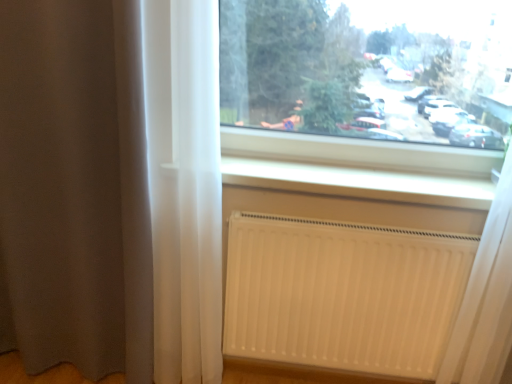
Question: Is transparent glass window at upper center in front of or behind white smooth radiator at lower center in the image?

Choices:
 (A) front
 (B) behind

Answer: (A)

Question: Is point (221, 29) positioned closer to the camera than point (245, 170)?

Choices:
 (A) farther
 (B) closer

Answer: (B)

Question: Estimate the real-world distances between objects in this image. Which object is closer to the white matte radiator at lower right?

Choices:
 (A) brown sheer curtain at left
 (B) transparent glass window at upper center
 (C) white smooth radiator at lower center

Answer: (C)

Question: Which object is positioned closest to the brown sheer curtain at left?

Choices:
 (A) transparent glass window at upper center
 (B) white smooth radiator at lower center
 (C) white matte radiator at lower right

Answer: (C)